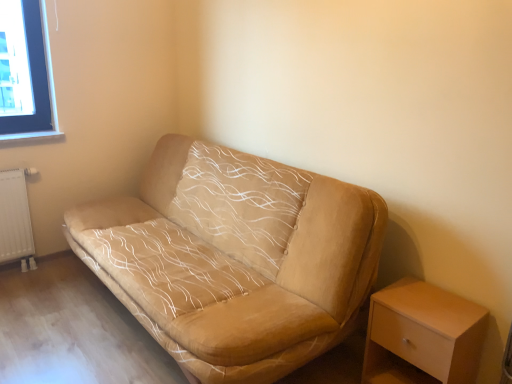
In order to face white textured radiator at lower left, should I rotate leftwards or rightwards?

To face it directly, rotate left by 28.927 degrees.

The width and height of the screenshot is (512, 384). I want to click on white matte wooden table at lower right, so click(423, 335).

In the scene shown: Between white matte wooden table at lower right and beige fabric couch at center, which one is positioned behind?

white matte wooden table at lower right is further from the camera.

From a real-world perspective, between white matte wooden table at lower right and beige fabric couch at center, who is vertically lower?

white matte wooden table at lower right is physically lower.

Would you say white textured radiator at lower left is inside or outside white matte wooden table at lower right?

white textured radiator at lower left is located beyond the bounds of white matte wooden table at lower right.

Where is `table below the white textured radiator at lower left (from a real-world perspective)`? The height and width of the screenshot is (384, 512). table below the white textured radiator at lower left (from a real-world perspective) is located at coordinates (423, 335).

Which object is closer to the camera taking this photo, white textured radiator at lower left or white matte wooden table at lower right?

white matte wooden table at lower right is in front.

Is white textured radiator at lower left facing towards white matte wooden table at lower right?

No.

Which object is closer to the camera taking this photo, white matte wooden table at lower right or white textured radiator at lower left?

white matte wooden table at lower right is closer to the camera.

Is white matte wooden table at lower right oriented towards white textured radiator at lower left?

No, white matte wooden table at lower right is not facing towards white textured radiator at lower left.

Is white matte wooden table at lower right not close to white textured radiator at lower left?

Indeed, white matte wooden table at lower right is not near white textured radiator at lower left.

Measure the distance between white matte wooden table at lower right and white textured radiator at lower left.

white matte wooden table at lower right and white textured radiator at lower left are 2.48 meters apart.

Is white textured radiator at lower left oriented towards beige fabric couch at center?

No, white textured radiator at lower left is not aimed at beige fabric couch at center.

Considering the relative positions of white textured radiator at lower left and beige fabric couch at center in the image provided, is white textured radiator at lower left to the left of beige fabric couch at center from the viewer's perspective?

Yes.

In the image, there is a beige fabric couch at center. At what (x,y) coordinates should I click in order to perform the action: click on radiator above it (from the image's perspective). Please return your answer as a coordinate pair (x, y). This screenshot has width=512, height=384. Looking at the image, I should click on (15, 219).

Who is shorter, white textured radiator at lower left or beige fabric couch at center?

Standing shorter between the two is white textured radiator at lower left.

How many degrees apart are the facing directions of beige fabric couch at center and white matte wooden table at lower right?

beige fabric couch at center and white matte wooden table at lower right are facing 0.74 degrees away from each other.

Which object is more forward, beige fabric couch at center or white matte wooden table at lower right?

beige fabric couch at center is more forward.

From a real-world perspective, which is physically below, beige fabric couch at center or white matte wooden table at lower right?

In real-world perspective, white matte wooden table at lower right is lower.

Between beige fabric couch at center and white matte wooden table at lower right, which one has larger size?

beige fabric couch at center is bigger.

Is beige fabric couch at center aimed at white textured radiator at lower left?

No, beige fabric couch at center is not oriented towards white textured radiator at lower left.

Does beige fabric couch at center have a lesser width compared to white textured radiator at lower left?

In fact, beige fabric couch at center might be wider than white textured radiator at lower left.

How different are the orientations of beige fabric couch at center and white textured radiator at lower left in degrees?

The angle between the facing direction of beige fabric couch at center and the facing direction of white textured radiator at lower left is 89.1 degrees.

Locate an element on the screen. radiator below the beige fabric couch at center (from a real-world perspective) is located at coordinates point(15,219).

You are a GUI agent. You are given a task and a screenshot of the screen. Output one action in this format:
    pyautogui.click(x=<x>, y=<y>)
    Task: Click on the studio couch in front of the white matte wooden table at lower right
    Image resolution: width=512 pixels, height=384 pixels.
    Given the screenshot: What is the action you would take?
    pyautogui.click(x=234, y=263)

Where is `radiator above the white matte wooden table at lower right (from a real-world perspective)`? The width and height of the screenshot is (512, 384). radiator above the white matte wooden table at lower right (from a real-world perspective) is located at coordinates (15, 219).

Looking at the image, which one is located further to beige fabric couch at center, white textured radiator at lower left or white matte wooden table at lower right?

white textured radiator at lower left is further to beige fabric couch at center.

Which object lies further to the anchor point white matte wooden table at lower right, white textured radiator at lower left or beige fabric couch at center?

The object further to white matte wooden table at lower right is white textured radiator at lower left.

When comparing their distances from beige fabric couch at center, does white matte wooden table at lower right or white textured radiator at lower left seem closer?

white matte wooden table at lower right lies closer to beige fabric couch at center than the other object.

Estimate the real-world distances between objects in this image. Which object is further from white matte wooden table at lower right, beige fabric couch at center or white textured radiator at lower left?

The object further to white matte wooden table at lower right is white textured radiator at lower left.

Estimate the real-world distances between objects in this image. Which object is further from white textured radiator at lower left, white matte wooden table at lower right or beige fabric couch at center?

white matte wooden table at lower right lies further to white textured radiator at lower left than the other object.

Considering their positions, is beige fabric couch at center positioned further to white textured radiator at lower left than white matte wooden table at lower right?

Among the two, white matte wooden table at lower right is located further to white textured radiator at lower left.

In order to click on studio couch between white textured radiator at lower left and white matte wooden table at lower right from left to right in this screenshot , I will do `click(234, 263)`.